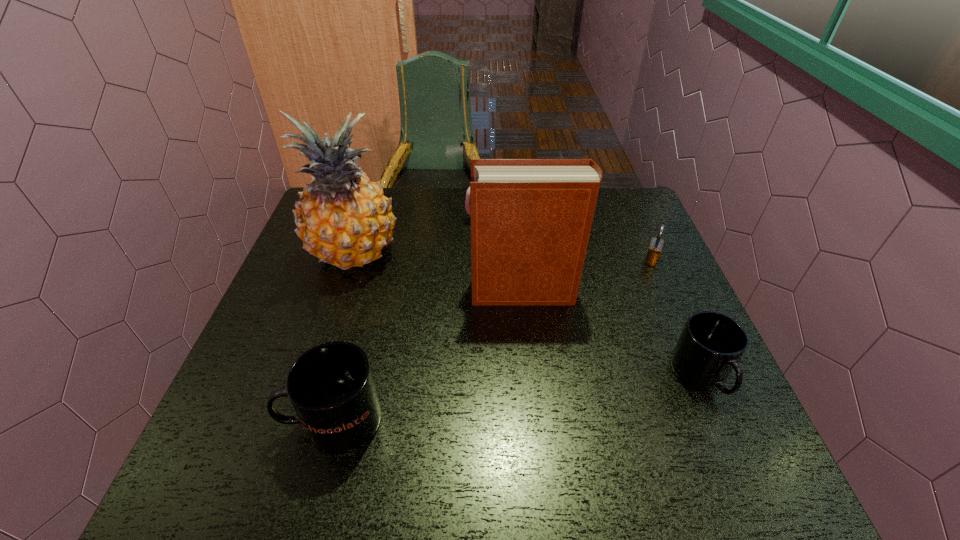
At what (x,y) coordinates should I click in order to perform the action: click on vacant space situated 0.350m on the side of the farthest mug with the handle. Please return your answer as a coordinate pair (x, y). The width and height of the screenshot is (960, 540). Looking at the image, I should click on (352, 220).

Find the location of `vacant space situated 0.300m on the side of the farthest mug with the handle`. vacant space situated 0.300m on the side of the farthest mug with the handle is located at coordinates (369, 220).

The width and height of the screenshot is (960, 540). Identify the location of vacant space located 0.150m on the right of the pineapple. (455, 255).

I want to click on vacant region located 0.280m on the left of the padlock, so click(x=541, y=260).

Locate an element on the screen. The image size is (960, 540). vacant region located on the open cover of the fifth shortest object is located at coordinates (441, 292).

This screenshot has width=960, height=540. What are the coordinates of `vacant space located on the open cover of the fifth shortest object` in the screenshot? It's located at (448, 292).

Find the location of `vacant point located 0.290m on the open cover of the fifth shortest object`. vacant point located 0.290m on the open cover of the fifth shortest object is located at coordinates (359, 292).

Locate an element on the screen. mug that is at the far edge is located at coordinates (467, 206).

Locate an element on the screen. pineapple positioned at the far edge is located at coordinates (343, 218).

Locate an element on the screen. mug at the left edge is located at coordinates (331, 387).